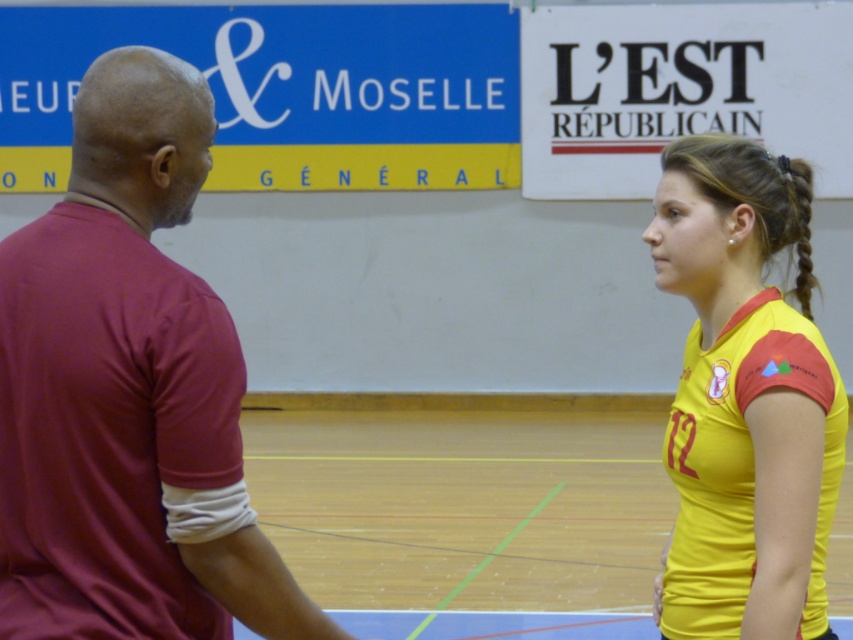
Question: From the image, what is the correct spatial relationship of maroon jersey at left in relation to yellow jersey at right?

Choices:
 (A) below
 (B) above

Answer: (B)

Question: Is maroon jersey at left closer to the viewer compared to yellow jersey at right?

Choices:
 (A) no
 (B) yes

Answer: (B)

Question: Which point is farther from the camera taking this photo?

Choices:
 (A) (773, 624)
 (B) (122, 426)

Answer: (A)

Question: Does maroon jersey at left appear on the left side of yellow jersey at right?

Choices:
 (A) no
 (B) yes

Answer: (B)

Question: Which of the following is the closest to the observer?

Choices:
 (A) (750, 339)
 (B) (234, 572)

Answer: (B)

Question: Which object appears farthest from the camera in this image?

Choices:
 (A) yellow jersey at right
 (B) maroon jersey at left

Answer: (A)